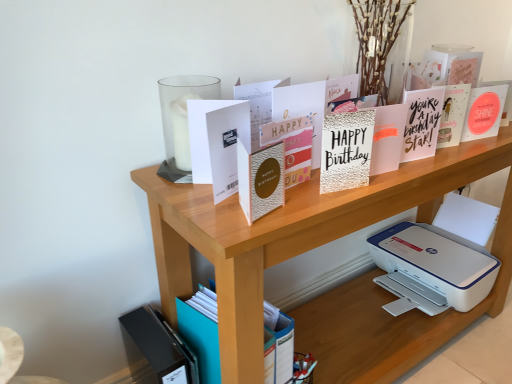
Locate an element on the screen. Image resolution: width=512 pixels, height=384 pixels. free space in front of white textured card at center, which is counted as the seventh paperback book, starting from the left is located at coordinates (366, 190).